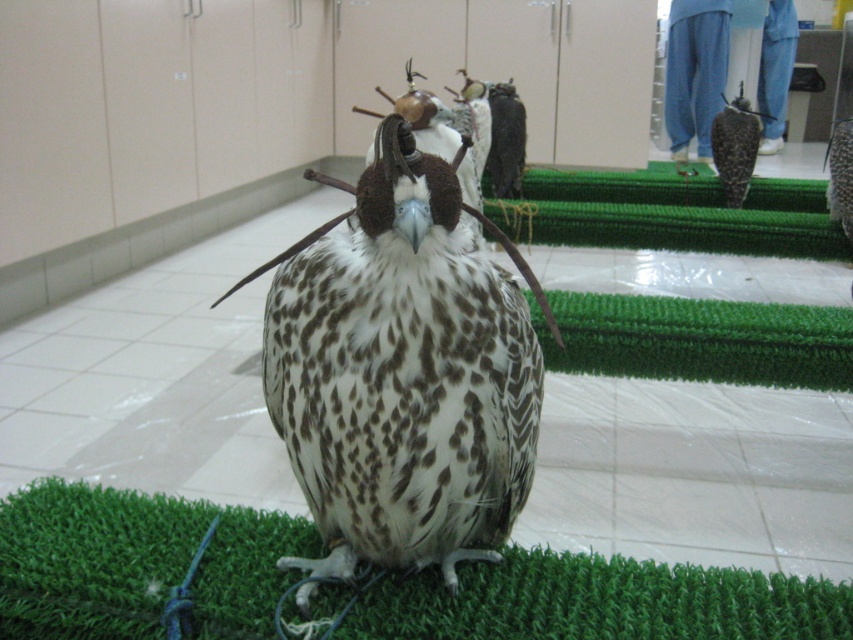
Between green artificial turf at center and brown speckled falcon at right, which one is positioned lower?

green artificial turf at center

Is point (628, 634) less distant than point (753, 147)?

Yes.

What do you see at coordinates (136, 563) in the screenshot? I see `green artificial turf at center` at bounding box center [136, 563].

Find the location of `green artificial turf at center`. green artificial turf at center is located at coordinates (136, 563).

Can you confirm if speckled feathered falcon at center is positioned below green artificial turf at center?

No.

Which is below, speckled feathered falcon at center or green artificial turf at center?

green artificial turf at center is below.

Does point (396, 422) lie in front of point (695, 595)?

Yes, point (396, 422) is in front of point (695, 595).

Identify the location of speckled feathered falcon at center. (403, 372).

Looking at this image, measure the distance from speckled feathered falcon at center to brown speckled falcon at right.

speckled feathered falcon at center is 4.07 meters from brown speckled falcon at right.

Which is above, speckled feathered falcon at center or brown speckled falcon at right?

Positioned higher is brown speckled falcon at right.

The width and height of the screenshot is (853, 640). Find the location of `speckled feathered falcon at center`. speckled feathered falcon at center is located at coordinates (403, 372).

At what (x,y) coordinates should I click in order to perform the action: click on speckled feathered falcon at center. Please return your answer as a coordinate pair (x, y). The height and width of the screenshot is (640, 853). Looking at the image, I should click on (403, 372).